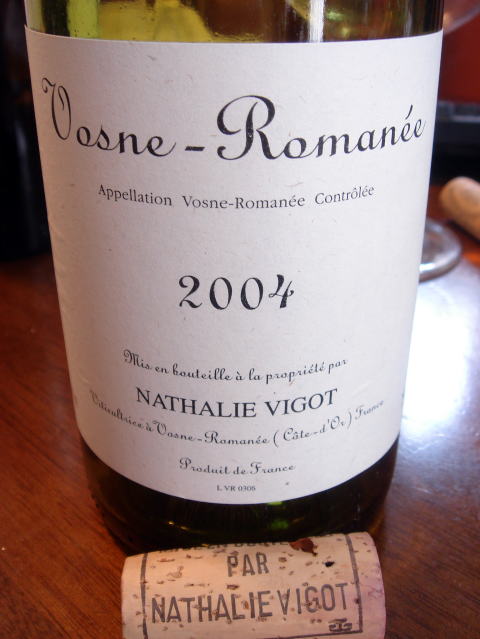
The image size is (480, 639). I want to click on brown wood table, so click(x=110, y=29), click(x=79, y=535).